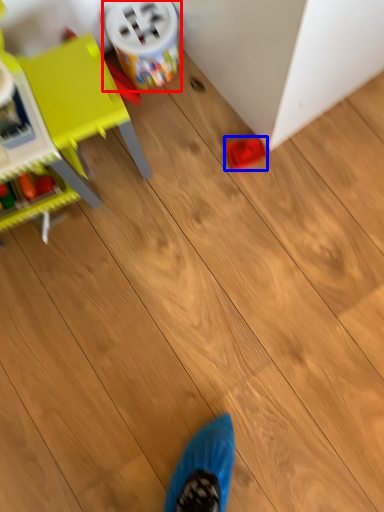
Question: Which object appears farthest to the camera in this image, toy (highlighted by a red box) or toy (highlighted by a blue box)?

Choices:
 (A) toy
 (B) toy

Answer: (B)